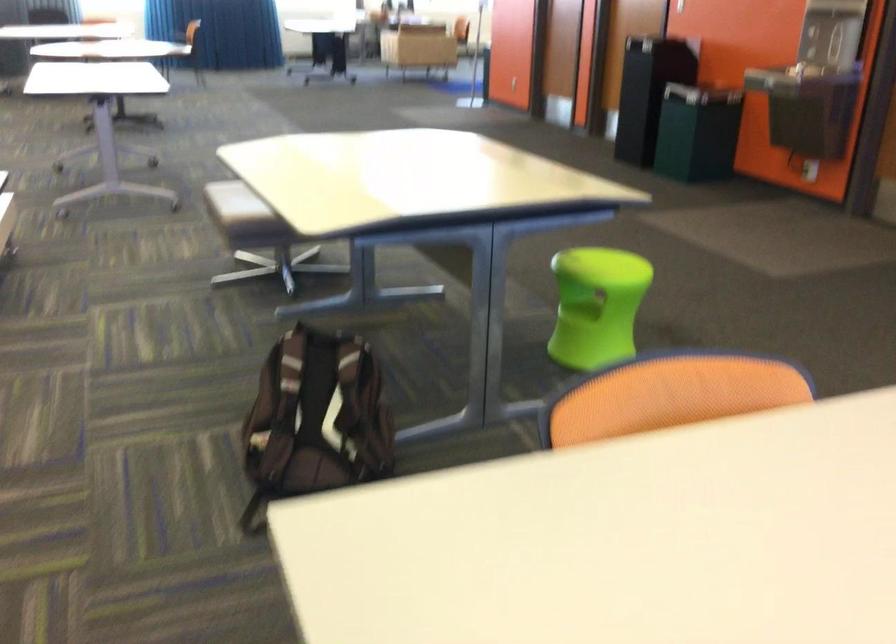
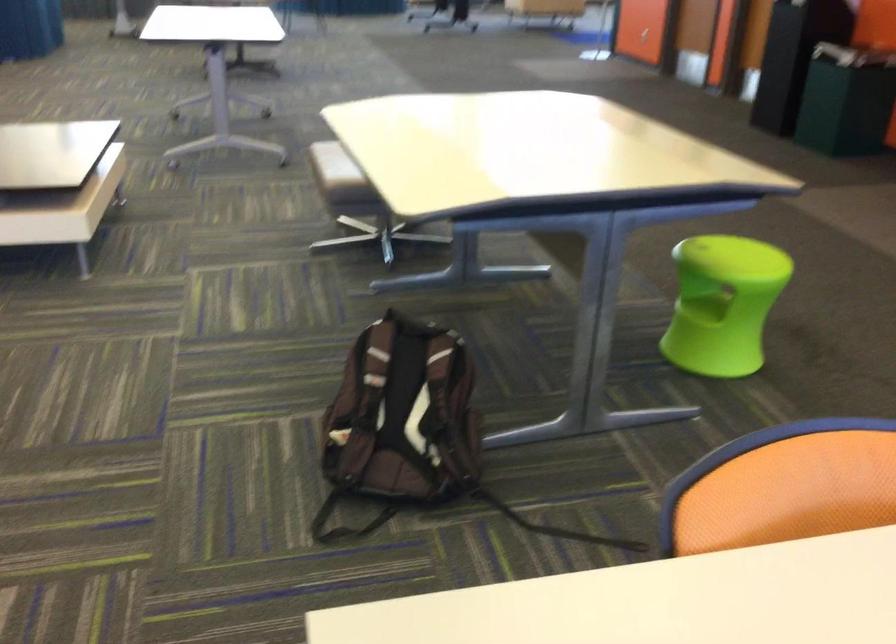
In the second image, find the point that corresponds to [320,417] in the first image.

(402, 413)